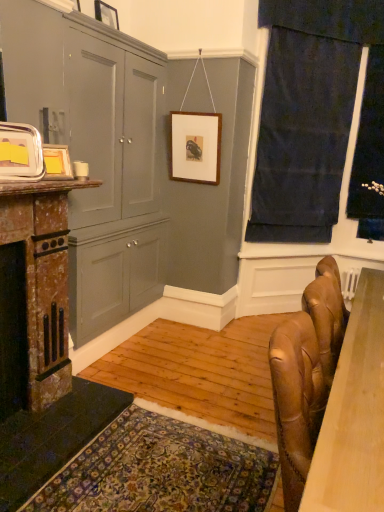
Question: Is matte gray cabinet at left to the right of metallic silver picture frame at upper left, which is counted as the 4th picture frame, starting from the back, from the viewer's perspective?

Choices:
 (A) no
 (B) yes

Answer: (B)

Question: Does matte gray cabinet at left contain metallic silver picture frame at upper left, which is the 4th picture frame from top to bottom?

Choices:
 (A) no
 (B) yes

Answer: (A)

Question: Is matte gray cabinet at left at the left side of metallic silver picture frame at upper left, the fourth picture frame viewed from the right?

Choices:
 (A) yes
 (B) no

Answer: (B)

Question: Is matte gray cabinet at left smaller than metallic silver picture frame at upper left, the fourth picture frame viewed from the right?

Choices:
 (A) yes
 (B) no

Answer: (B)

Question: From the image's perspective, would you say matte gray cabinet at left is shown under metallic silver picture frame at upper left, which appears as the 1th picture frame when ordered from the bottom?

Choices:
 (A) no
 (B) yes

Answer: (B)

Question: Can you confirm if matte gray cabinet at left is thinner than metallic silver picture frame at upper left, which is the 4th picture frame from top to bottom?

Choices:
 (A) yes
 (B) no

Answer: (B)

Question: Is wooden picture frame at upper center, which is counted as the 1th picture frame, starting from the top, surrounded by dark blue fabric at upper right?

Choices:
 (A) no
 (B) yes

Answer: (A)

Question: Does dark blue fabric at upper right have a lesser height compared to wooden picture frame at upper center, marked as the fourth picture frame in a bottom-to-top arrangement?

Choices:
 (A) yes
 (B) no

Answer: (B)

Question: Is dark blue fabric at upper right oriented towards wooden picture frame at upper center, marked as the fourth picture frame in a bottom-to-top arrangement?

Choices:
 (A) no
 (B) yes

Answer: (A)

Question: Does dark blue fabric at upper right have a greater width compared to wooden picture frame at upper center, marked as the fourth picture frame in a bottom-to-top arrangement?

Choices:
 (A) yes
 (B) no

Answer: (A)

Question: From the image's perspective, is dark blue fabric at upper right located beneath wooden picture frame at upper center, which is counted as the 1th picture frame, starting from the top?

Choices:
 (A) yes
 (B) no

Answer: (A)

Question: Considering the relative sizes of dark blue fabric at upper right and wooden picture frame at upper center, marked as the fourth picture frame in a bottom-to-top arrangement, in the image provided, is dark blue fabric at upper right taller than wooden picture frame at upper center, marked as the fourth picture frame in a bottom-to-top arrangement,?

Choices:
 (A) no
 (B) yes

Answer: (B)

Question: From a real-world perspective, is matte gray cabinet at left physically below black velvet curtain at right?

Choices:
 (A) yes
 (B) no

Answer: (A)